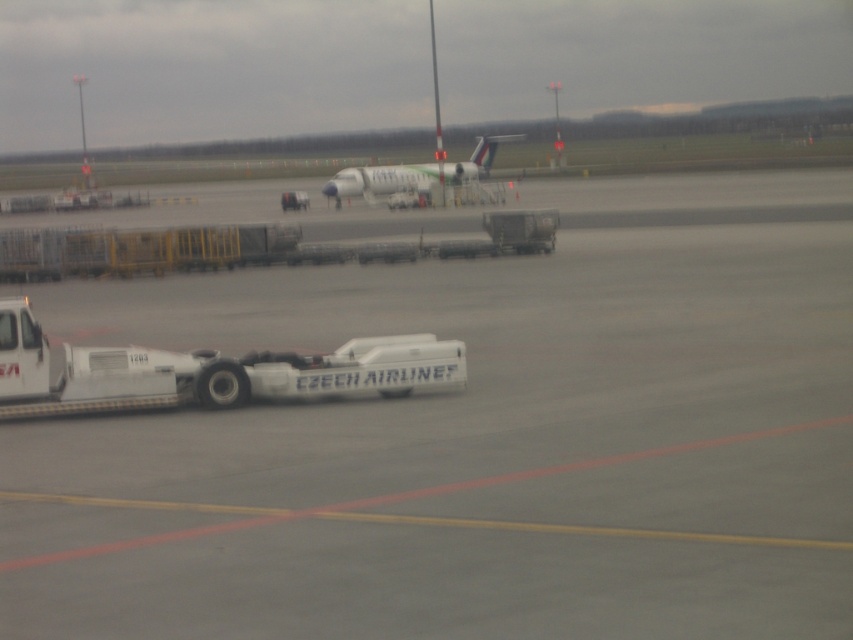
Question: Where is white rubber tarmac at center located in relation to white matte tow truck at lower left in the image?

Choices:
 (A) below
 (B) above

Answer: (B)

Question: Which point appears closest to the camera in this image?

Choices:
 (A) (422, 300)
 (B) (486, 172)
 (C) (363, 378)

Answer: (C)

Question: Which of the following is the closest to the observer?

Choices:
 (A) white glossy airplane at center
 (B) white rubber tarmac at center

Answer: (B)

Question: Considering the relative positions of white rubber tarmac at center and white glossy airplane at center in the image provided, where is white rubber tarmac at center located with respect to white glossy airplane at center?

Choices:
 (A) left
 (B) right

Answer: (A)

Question: Does white rubber tarmac at center appear over white glossy airplane at center?

Choices:
 (A) yes
 (B) no

Answer: (B)

Question: Which point is farther to the camera?

Choices:
 (A) white rubber tarmac at center
 (B) white matte tow truck at lower left

Answer: (B)